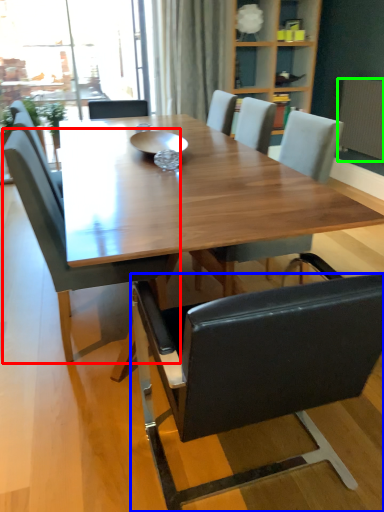
Question: Considering the real-world distances, which object is closest to chair (highlighted by a red box)? chair (highlighted by a blue box) or radiator (highlighted by a green box).

Choices:
 (A) chair
 (B) radiator

Answer: (A)